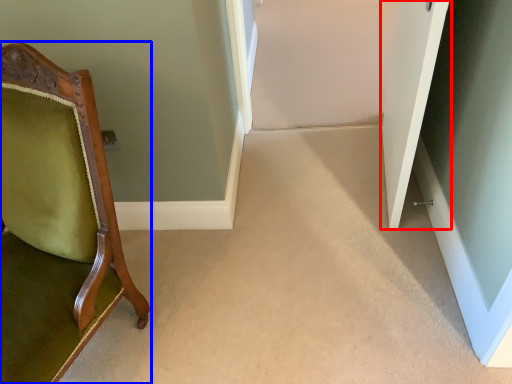
Question: Which of the following is the farthest to the observer, door (highlighted by a red box) or chair (highlighted by a blue box)?

Choices:
 (A) door
 (B) chair

Answer: (A)